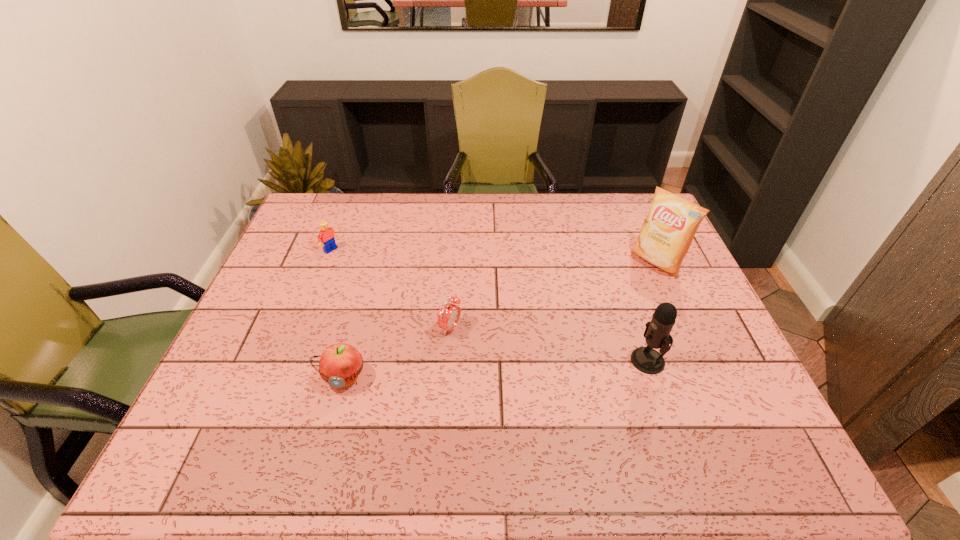
Where is `the fourth object from right to left`? Image resolution: width=960 pixels, height=540 pixels. the fourth object from right to left is located at coordinates (340, 364).

Locate an element on the screen. The height and width of the screenshot is (540, 960). microphone is located at coordinates (657, 335).

The width and height of the screenshot is (960, 540). Identify the location of the third object from left to right. (448, 316).

The width and height of the screenshot is (960, 540). I want to click on the third farthest object, so click(448, 316).

I want to click on the leftmost object, so click(x=327, y=234).

This screenshot has height=540, width=960. I want to click on the rightmost object, so click(667, 233).

At what (x,y) coordinates should I click in order to perform the action: click on free spot located 0.060m on the surface of the apple. Please return your answer as a coordinate pair (x, y). This screenshot has width=960, height=540. Looking at the image, I should click on (332, 418).

This screenshot has width=960, height=540. In order to click on vacant point located 0.150m on the right of the microphone in this screenshot , I will do `click(726, 361)`.

I want to click on vacant region located 0.130m on the face of the third object from left to right, so click(504, 353).

Locate an element on the screen. vacant position located on the face of the third object from left to right is located at coordinates (552, 374).